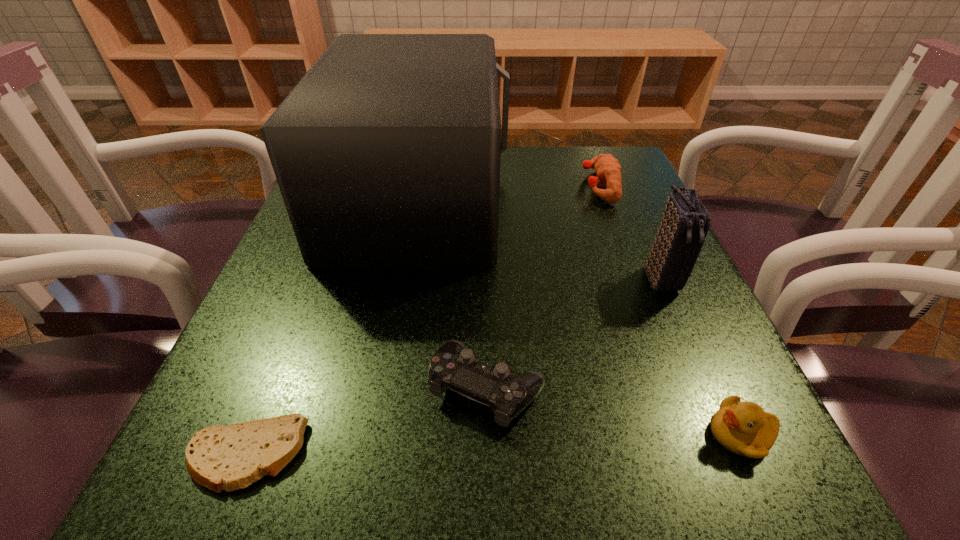
The width and height of the screenshot is (960, 540). I want to click on microwave oven that is positioned at the left edge, so click(x=387, y=152).

Locate an element on the screen. The width and height of the screenshot is (960, 540). pita bread present at the left edge is located at coordinates (218, 457).

I want to click on clutch bag positioned at the right edge, so click(685, 222).

Find the location of a particular element. puncher that is at the right edge is located at coordinates (608, 169).

Locate an element on the screen. duckling that is at the right edge is located at coordinates (743, 428).

Locate an element on the screen. The image size is (960, 540). object located in the far left corner section of the desktop is located at coordinates (387, 152).

Where is `object located at the near left corner`? object located at the near left corner is located at coordinates (218, 457).

I want to click on object present at the far right corner, so click(x=608, y=169).

The width and height of the screenshot is (960, 540). In order to click on object present at the near right corner in this screenshot , I will do `click(743, 428)`.

In the image, there is a desktop. Identify the location of vacant space at the far edge. (512, 171).